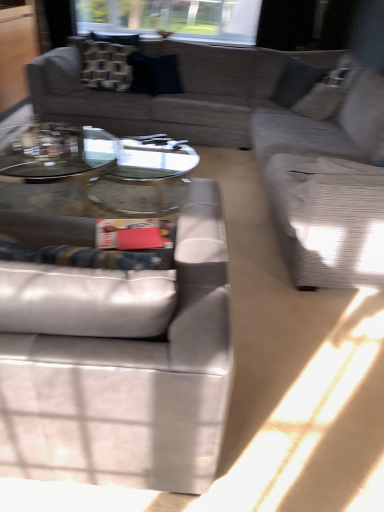
This screenshot has width=384, height=512. I want to click on clear glass coffee table at center, so click(93, 172).

Describe the element at coordinates (154, 74) in the screenshot. I see `velvet dark blue pillow at center, acting as the second pillow starting from the left` at that location.

The height and width of the screenshot is (512, 384). I want to click on velvet dark blue pillow at center, arranged as the 1th pillow when viewed from the right, so click(154, 74).

Where is `leather couch at lower left, which is the 1th studio couch in bottom-to-top order`? Image resolution: width=384 pixels, height=512 pixels. leather couch at lower left, which is the 1th studio couch in bottom-to-top order is located at coordinates (120, 364).

Between leather couch at lower left, which is the 1th studio couch in bottom-to-top order, and transparent glass window at upper center, which one has smaller width?

transparent glass window at upper center.

From the image's perspective, is leather couch at lower left, positioned as the 1th studio couch in front-to-back order, located beneath transparent glass window at upper center?

Correct, leather couch at lower left, positioned as the 1th studio couch in front-to-back order, appears lower than transparent glass window at upper center in the image.

Can you confirm if leather couch at lower left, positioned as the second studio couch in back-to-front order, is shorter than transparent glass window at upper center?

No.

Would you say leather couch at lower left, which is the 2th studio couch in top-to-bottom order, is to the left or to the right of transparent glass window at upper center in the picture?

leather couch at lower left, which is the 2th studio couch in top-to-bottom order, is to the left of transparent glass window at upper center.

Considering the sizes of objects patterned fabric pillow at upper left, acting as the first pillow starting from the left, and clear glass coffee table at center in the image provided, who is thinner, patterned fabric pillow at upper left, acting as the first pillow starting from the left, or clear glass coffee table at center?

Thinner between the two is patterned fabric pillow at upper left, acting as the first pillow starting from the left.

Considering the sizes of patterned fabric pillow at upper left, marked as the second pillow in a right-to-left arrangement, and clear glass coffee table at center in the image, is patterned fabric pillow at upper left, marked as the second pillow in a right-to-left arrangement, taller or shorter than clear glass coffee table at center?

patterned fabric pillow at upper left, marked as the second pillow in a right-to-left arrangement, is taller than clear glass coffee table at center.

Which pillow is the 2nd one when counting from the back of the clear glass coffee table at center? Please provide its 2D coordinates.

[(107, 65)]

Which object is positioned more to the left, patterned fabric pillow at upper left, acting as the first pillow starting from the left, or clear glass coffee table at center?

Positioned to the left is patterned fabric pillow at upper left, acting as the first pillow starting from the left.

Which of these two, patterned fabric pillow at upper left, marked as the second pillow in a right-to-left arrangement, or transparent glass window at upper center, is smaller?

patterned fabric pillow at upper left, marked as the second pillow in a right-to-left arrangement, is smaller.

This screenshot has height=512, width=384. Find the location of `window screen on the right of patterned fabric pillow at upper left, marked as the second pillow in a right-to-left arrangement`. window screen on the right of patterned fabric pillow at upper left, marked as the second pillow in a right-to-left arrangement is located at coordinates (173, 18).

Can you tell me how much patterned fabric pillow at upper left, acting as the first pillow starting from the left, and transparent glass window at upper center differ in facing direction?

The angle between the facing direction of patterned fabric pillow at upper left, acting as the first pillow starting from the left, and the facing direction of transparent glass window at upper center is 0.0879 degrees.

Does transparent glass window at upper center have a greater height compared to velvet dark blue pillow at center, arranged as the 1th pillow when viewed from the right?

Yes.

Do you think transparent glass window at upper center is within velvet dark blue pillow at center, arranged as the 1th pillow when viewed from the right, or outside of it?

transparent glass window at upper center is not enclosed by velvet dark blue pillow at center, arranged as the 1th pillow when viewed from the right.

Which object is further away from the camera, transparent glass window at upper center or velvet dark blue pillow at center, arranged as the 1th pillow when viewed from the right?

transparent glass window at upper center is behind.

Considering the sizes of objects clear glass coffee table at center and textured gray couch at right in the image provided, who is smaller, clear glass coffee table at center or textured gray couch at right?

clear glass coffee table at center is smaller.

From a real-world perspective, which object stands above the other?

textured gray couch at right.

Which is less distant, (179, 198) or (369, 172)?

Positioned in front is point (369, 172).

Is clear glass coffee table at center looking in the opposite direction of textured gray couch at right?

That's right, clear glass coffee table at center is facing away from textured gray couch at right.

Is textured gray couch at upper center, the second studio couch positioned from the front, a part of patterned fabric pillow at upper left, marked as the second pillow in a right-to-left arrangement?

No, textured gray couch at upper center, the second studio couch positioned from the front, is not inside patterned fabric pillow at upper left, marked as the second pillow in a right-to-left arrangement.

From a real-world perspective, which object stands above the other?

From a 3D spatial view, patterned fabric pillow at upper left, acting as the first pillow starting from the left, is above.

Considering the positions of point (118, 80) and point (181, 71), is point (118, 80) closer or farther from the camera than point (181, 71)?

Point (118, 80).

Can you confirm if clear glass coffee table at center is bigger than patterned fabric pillow at upper left, marked as the second pillow in a right-to-left arrangement?

Yes.

Is patterned fabric pillow at upper left, marked as the second pillow in a right-to-left arrangement, at the back of clear glass coffee table at center?

clear glass coffee table at center does not have its back to patterned fabric pillow at upper left, marked as the second pillow in a right-to-left arrangement.

Between point (93, 180) and point (86, 86), which one is positioned behind?

The point (86, 86) is farther from the camera.

You are a GUI agent. You are given a task and a screenshot of the screen. Output one action in this format:
    pyautogui.click(x=<x>, y=<y>)
    Task: Click on the coffee table that appears below the patterned fabric pillow at upper left, acting as the first pillow starting from the left (from a real-world perspective)
    Image resolution: width=384 pixels, height=512 pixels.
    Given the screenshot: What is the action you would take?
    pyautogui.click(x=93, y=172)

Where is `window screen located on the right of leather couch at lower left, positioned as the 1th studio couch in front-to-back order`? window screen located on the right of leather couch at lower left, positioned as the 1th studio couch in front-to-back order is located at coordinates point(173,18).

You are a GUI agent. You are given a task and a screenshot of the screen. Output one action in this format:
    pyautogui.click(x=<x>, y=<y>)
    Task: Click on the pillow that is the 2nd object located above the clear glass coffee table at center (from the image's perspective)
    The height and width of the screenshot is (512, 384).
    Given the screenshot: What is the action you would take?
    pyautogui.click(x=107, y=65)

Considering their positions, is textured gray couch at upper center, which is counted as the 2th studio couch, starting from the bottom, positioned further to leather couch at lower left, which is the 2th studio couch in top-to-bottom order, than velvet dark blue pillow at center, acting as the second pillow starting from the left?

The object further to leather couch at lower left, which is the 2th studio couch in top-to-bottom order, is velvet dark blue pillow at center, acting as the second pillow starting from the left.

Estimate the real-world distances between objects in this image. Which object is further from patterned fabric pillow at upper left, acting as the first pillow starting from the left, textured gray couch at right or transparent glass window at upper center?

The object further to patterned fabric pillow at upper left, acting as the first pillow starting from the left, is transparent glass window at upper center.

Looking at the image, which one is located further to clear glass coffee table at center, textured gray couch at right or textured gray couch at upper center, the second studio couch positioned from the front?

textured gray couch at right.

Estimate the real-world distances between objects in this image. Which object is further from clear glass coffee table at center, patterned fabric pillow at upper left, acting as the first pillow starting from the left, or textured gray couch at right?

Among the two, textured gray couch at right is located further to clear glass coffee table at center.

Considering their positions, is patterned fabric pillow at upper left, marked as the second pillow in a right-to-left arrangement, positioned further to leather couch at lower left, positioned as the second studio couch in back-to-front order, than velvet dark blue pillow at center, arranged as the 1th pillow when viewed from the right?

velvet dark blue pillow at center, arranged as the 1th pillow when viewed from the right, lies further to leather couch at lower left, positioned as the second studio couch in back-to-front order, than the other object.

Considering their positions, is textured gray couch at upper center, the second studio couch positioned from the front, positioned closer to patterned fabric pillow at upper left, marked as the second pillow in a right-to-left arrangement, than velvet dark blue pillow at center, arranged as the 1th pillow when viewed from the right?

velvet dark blue pillow at center, arranged as the 1th pillow when viewed from the right, is positioned closer to the anchor patterned fabric pillow at upper left, marked as the second pillow in a right-to-left arrangement.

Based on their spatial positions, is leather couch at lower left, positioned as the 1th studio couch in front-to-back order, or clear glass coffee table at center further from textured gray couch at right?

leather couch at lower left, positioned as the 1th studio couch in front-to-back order, lies further to textured gray couch at right than the other object.

Based on their spatial positions, is textured gray couch at upper center, the 1th studio couch when ordered from back to front, or clear glass coffee table at center further from velvet dark blue pillow at center, arranged as the 1th pillow when viewed from the right?

The object further to velvet dark blue pillow at center, arranged as the 1th pillow when viewed from the right, is clear glass coffee table at center.

Find the location of a particular element. This screenshot has width=384, height=512. studio couch between clear glass coffee table at center and velvet dark blue pillow at center, arranged as the 1th pillow when viewed from the right, along the z-axis is located at coordinates (228, 100).

Where is `studio couch between clear glass coffee table at center and patterned fabric pillow at upper left, marked as the second pillow in a right-to-left arrangement, from front to back`? studio couch between clear glass coffee table at center and patterned fabric pillow at upper left, marked as the second pillow in a right-to-left arrangement, from front to back is located at coordinates (228, 100).

Locate an element on the screen. The image size is (384, 512). pillow situated between patterned fabric pillow at upper left, acting as the first pillow starting from the left, and textured gray couch at upper center, which is counted as the 2th studio couch, starting from the bottom, from left to right is located at coordinates (154, 74).

Where is `coffee table between patterned fabric pillow at upper left, marked as the second pillow in a right-to-left arrangement, and textured gray couch at right`? coffee table between patterned fabric pillow at upper left, marked as the second pillow in a right-to-left arrangement, and textured gray couch at right is located at coordinates (x=93, y=172).